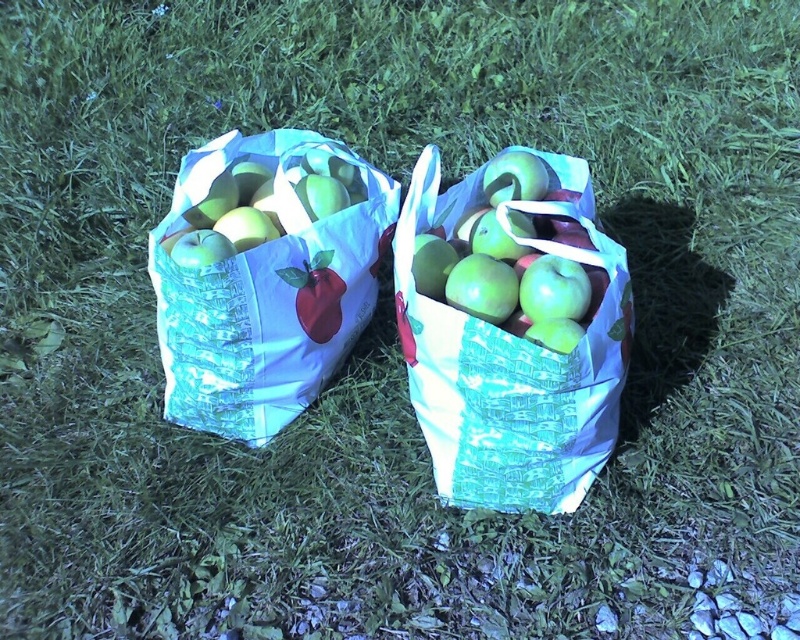
You are standing in a garden and see the white paper bag with apples at left and the green matte apple at center. Which object is closer to you?

The white paper bag with apples at left is closer to you because it is further to the viewer than the green matte apple at center.

You have two shopping bags in front of you on the grass. One is a white paper bag with apples at left and the other is a matte white bag at center. If you need to place both bags side by side in a narrow space, which bag should you move first to ensure they fit?

The white paper bag with apples at left is larger in width than the matte white bag at center, so you should move the larger white paper bag with apples at left first to accommodate its size in the narrow space.

You are organizing a picnic and need to choose a bag to carry more apples. You have two options in the image, the white paper bag with apples at left and the matte white bag at center. Based on their sizes, which bag should you choose?

The matte white bag at center is taller than the white paper bag with apples at left, so it can hold more apples.